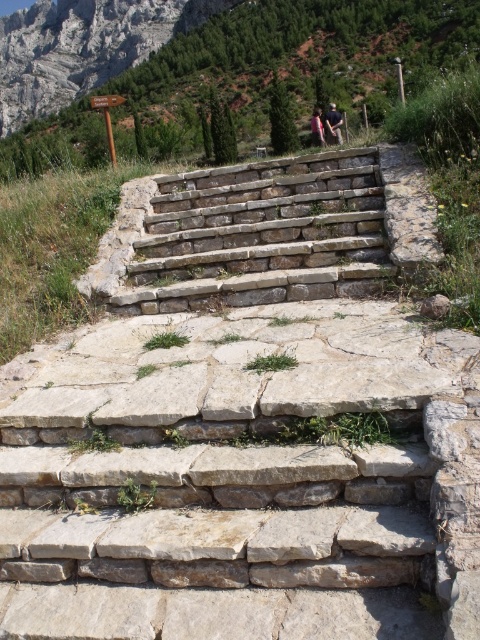
Question: Among these objects, which one is farthest from the camera?

Choices:
 (A) dark blue shirt at center
 (B) natural stone stairs at center
 (C) pink fabric at center

Answer: (C)

Question: Which point is farther to the camera?

Choices:
 (A) (312, 131)
 (B) (328, 129)
 (C) (124, 292)

Answer: (A)

Question: From the image, what is the correct spatial relationship of dark blue shirt at center in relation to pink fabric at center?

Choices:
 (A) right
 (B) left

Answer: (B)

Question: Which of these objects is positioned closest to the dark blue shirt at center?

Choices:
 (A) natural stone stairs at center
 (B) pink fabric at center

Answer: (B)

Question: Can you confirm if natural stone stairs at center is positioned to the right of pink fabric at center?

Choices:
 (A) yes
 (B) no

Answer: (B)

Question: From the image, what is the correct spatial relationship of natural stone stairs at center in relation to dark blue shirt at center?

Choices:
 (A) above
 (B) below

Answer: (B)